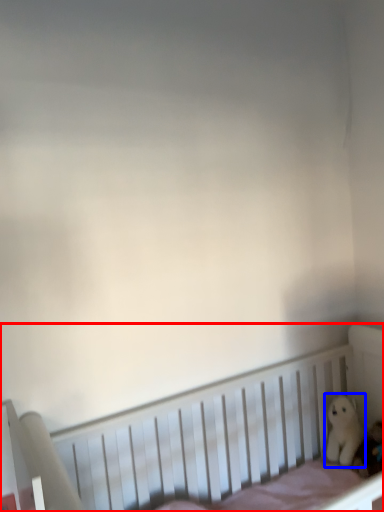
Question: Among these objects, which one is nearest to the camera, infant bed (highlighted by a red box) or toy (highlighted by a blue box)?

Choices:
 (A) infant bed
 (B) toy

Answer: (A)